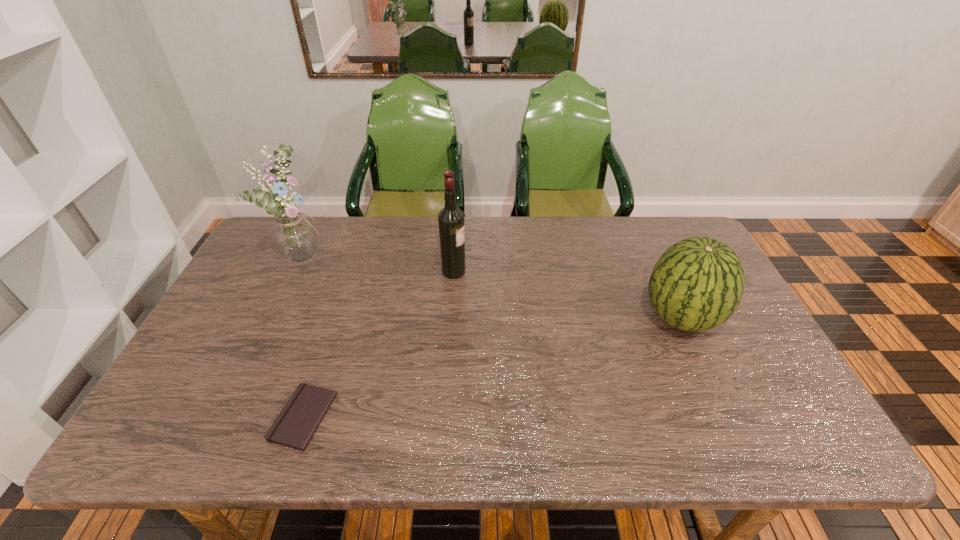
You are a GUI agent. You are given a task and a screenshot of the screen. Output one action in this format:
    pyautogui.click(x=<x>, y=<y>)
    Task: Click on the object that is at the far edge
    The image size is (960, 540).
    Given the screenshot: What is the action you would take?
    pyautogui.click(x=294, y=235)

At what (x,y) coordinates should I click in order to perform the action: click on object present at the near edge. Please return your answer as a coordinate pair (x, y). Looking at the image, I should click on (294, 427).

Where is `object situated at the left edge`? object situated at the left edge is located at coordinates click(x=294, y=235).

Locate an element on the screen. The width and height of the screenshot is (960, 540). object that is at the right edge is located at coordinates (697, 284).

The height and width of the screenshot is (540, 960). I want to click on object present at the far left corner, so click(294, 235).

Find the location of a particular element. Image resolution: width=960 pixels, height=540 pixels. vacant space at the far edge of the desktop is located at coordinates (539, 225).

The image size is (960, 540). I want to click on vacant area at the left edge of the desktop, so click(x=224, y=359).

Find the location of a particular element. This screenshot has height=540, width=960. vacant space at the far right corner of the desktop is located at coordinates (673, 225).

I want to click on free space at the near right corner, so click(x=759, y=433).

Find the location of `vacant space that is in between the second object from left to right and the second shortest object`. vacant space that is in between the second object from left to right and the second shortest object is located at coordinates (492, 367).